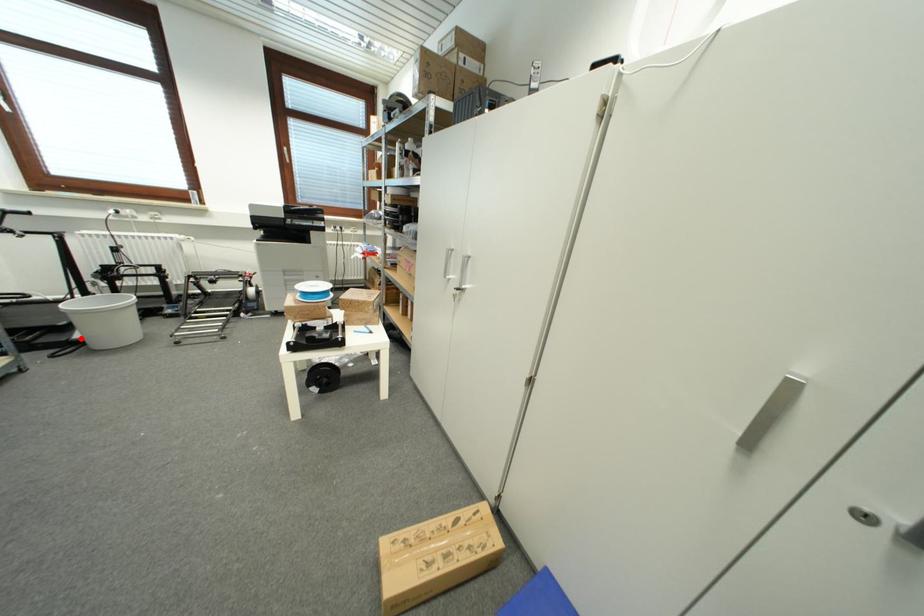
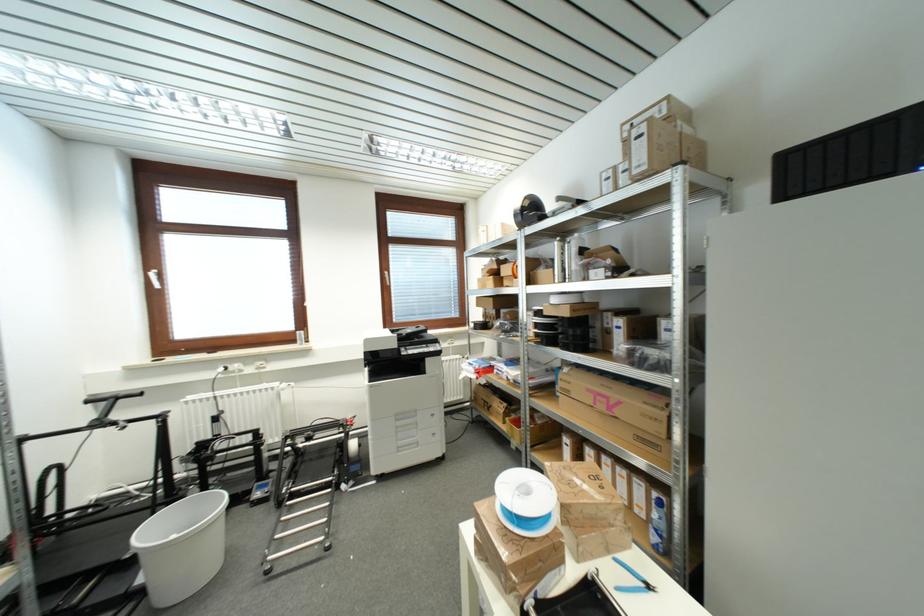
The point at the highlighted location is marked in the first image. Where is the corresponding point in the second image?

(144, 582)